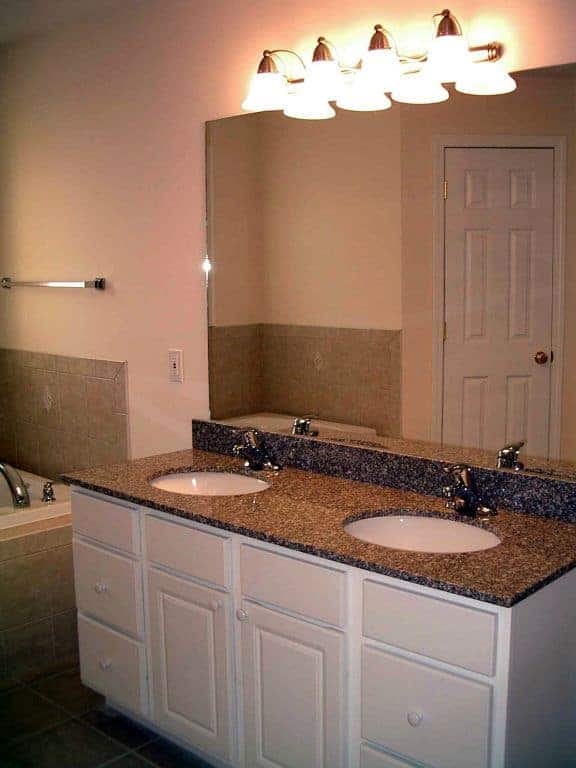
This screenshot has height=768, width=576. Find the location of `lights`. lights is located at coordinates (366, 58).